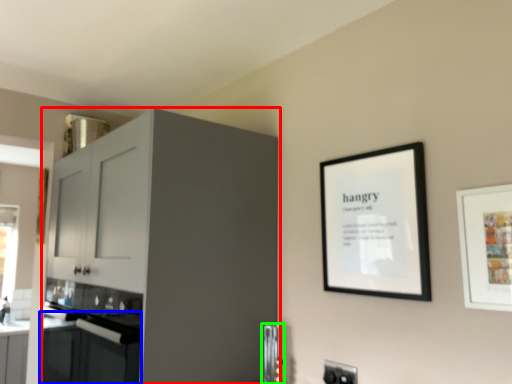
Question: Which is nearer to the cabinetry (highlighted by a red box)? oven (highlighted by a blue box) or appliance (highlighted by a green box).

Choices:
 (A) oven
 (B) appliance

Answer: (A)